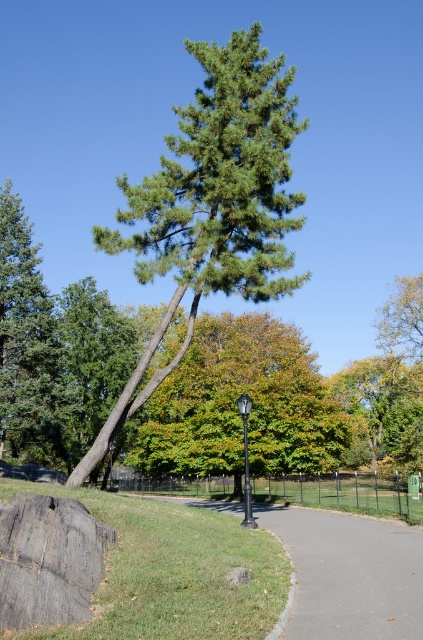
Question: Which object is positioned closest to the green leafy tree at center?

Choices:
 (A) green needle-like at center
 (B) green needle-like tree at upper left
 (C) gray rough rock at lower left
 (D) black metal lamp post at center

Answer: (A)

Question: Which of the following is the closest to the observer?

Choices:
 (A) tap(227, 513)
 (B) tap(335, 403)
 (C) tap(32, 563)
 (D) tap(247, 400)

Answer: (C)

Question: Where is green leafy tree at center located in relation to gray asphalt path at center in the image?

Choices:
 (A) below
 (B) above

Answer: (B)

Question: Is green needle-like at center to the right of black metal lamp post at center from the viewer's perspective?

Choices:
 (A) no
 (B) yes

Answer: (A)

Question: Is green needle-like at center to the left of gray asphalt path at center from the viewer's perspective?

Choices:
 (A) yes
 (B) no

Answer: (A)

Question: Which point is farther to the camera?

Choices:
 (A) (323, 605)
 (B) (246, 413)
 (C) (313, 435)

Answer: (C)